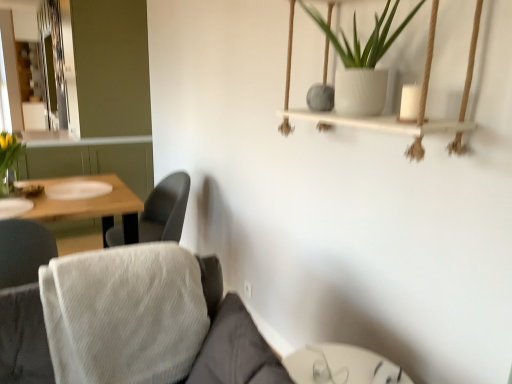
Question: From a real-world perspective, is clear glass vase at left physically located above or below transparent glass table at lower center?

Choices:
 (A) above
 (B) below

Answer: (A)

Question: Is clear glass vase at left taller or shorter than transparent glass table at lower center?

Choices:
 (A) short
 (B) tall

Answer: (A)

Question: Considering the real-world distances, which object is closest to the gray fabric chair at center-left?

Choices:
 (A) white textured pot at upper center
 (B) clear glass vase at left
 (C) transparent glass table at lower center
 (D) white fabric couch at lower left

Answer: (B)

Question: Which object is positioned closest to the white textured pot at upper center?

Choices:
 (A) gray fabric chair at center-left
 (B) transparent glass table at lower center
 (C) clear glass vase at left
 (D) white fabric couch at lower left

Answer: (D)